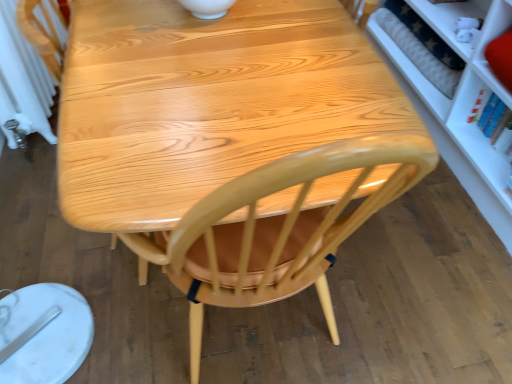
Question: Based on their sizes in the image, would you say glossy wood chair at center is bigger or smaller than white radiator at left?

Choices:
 (A) big
 (B) small

Answer: (A)

Question: From a real-world perspective, is glossy wood chair at center positioned above or below white radiator at left?

Choices:
 (A) below
 (B) above

Answer: (A)

Question: Considering the positions of point (353, 190) and point (5, 125), is point (353, 190) closer or farther from the camera than point (5, 125)?

Choices:
 (A) closer
 (B) farther

Answer: (A)

Question: From their relative heights in the image, would you say white radiator at left is taller or shorter than glossy wood chair at center?

Choices:
 (A) short
 (B) tall

Answer: (B)

Question: Relative to glossy wood chair at center, is white radiator at left in front or behind?

Choices:
 (A) behind
 (B) front

Answer: (A)

Question: Considering the positions of white radiator at left and glossy wood chair at center in the image, is white radiator at left bigger or smaller than glossy wood chair at center?

Choices:
 (A) big
 (B) small

Answer: (B)

Question: Looking at their shapes, would you say white radiator at left is wider or thinner than glossy wood chair at center?

Choices:
 (A) thin
 (B) wide

Answer: (A)